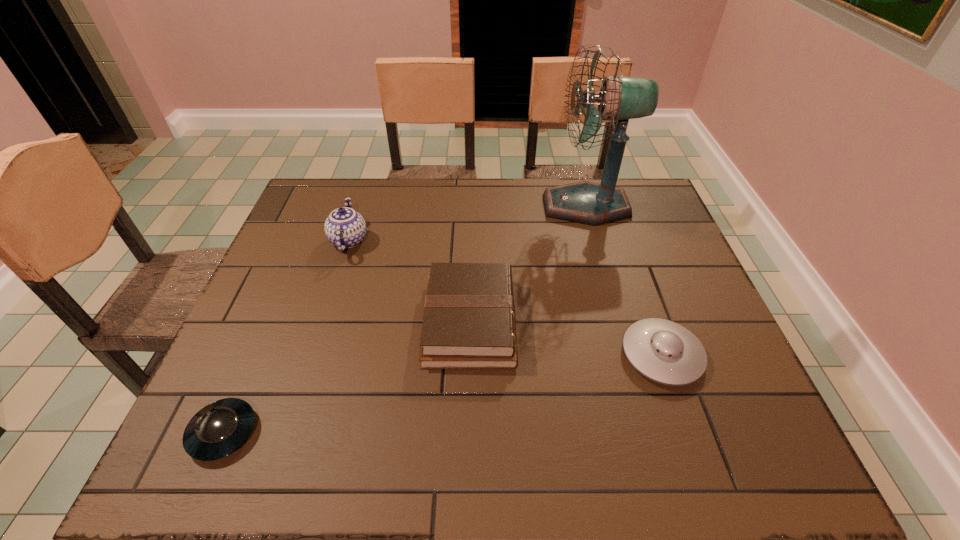
Locate an element on the screen. This screenshot has height=540, width=960. free location at the near right corner is located at coordinates (738, 467).

Locate an element on the screen. free spot between the Bible and the farther saucer is located at coordinates (565, 338).

The height and width of the screenshot is (540, 960). What are the coordinates of `vacant space in between the second tallest object and the fan` in the screenshot? It's located at (468, 223).

Where is `vacant region between the fan and the farther saucer`? Image resolution: width=960 pixels, height=540 pixels. vacant region between the fan and the farther saucer is located at coordinates (624, 281).

The image size is (960, 540). Identify the location of free area in between the right saucer and the tallest object. pos(624,281).

This screenshot has width=960, height=540. Find the location of `unoccupied area between the nearer saucer and the fan`. unoccupied area between the nearer saucer and the fan is located at coordinates (404, 319).

Where is `free area in between the taller saucer and the third object from left to right`? The width and height of the screenshot is (960, 540). free area in between the taller saucer and the third object from left to right is located at coordinates (565, 338).

Where is `free space between the shorter saucer and the third object from right to left`? This screenshot has height=540, width=960. free space between the shorter saucer and the third object from right to left is located at coordinates (347, 377).

Locate an element on the screen. unoccupied area between the shortest object and the farther saucer is located at coordinates (443, 394).

In order to click on the third closest object to the tallest object in this screenshot , I will do (345, 228).